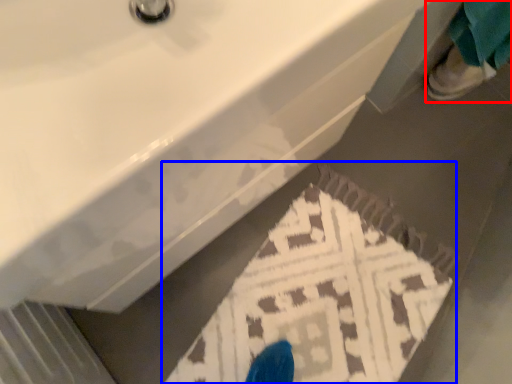
Question: Which object is further to the camera taking this photo, person (highlighted by a red box) or doormat (highlighted by a blue box)?

Choices:
 (A) person
 (B) doormat

Answer: (A)